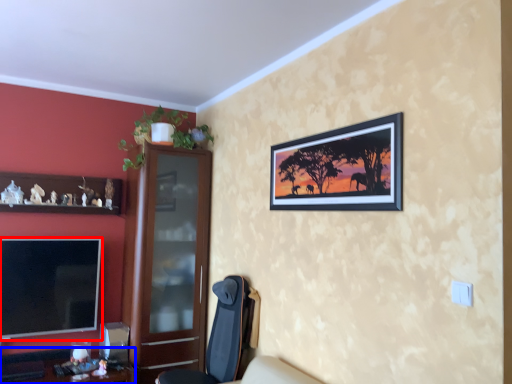
Question: Which of the following is the farthest to the observer, television (highlighted by a red box) or desk (highlighted by a blue box)?

Choices:
 (A) television
 (B) desk

Answer: (A)